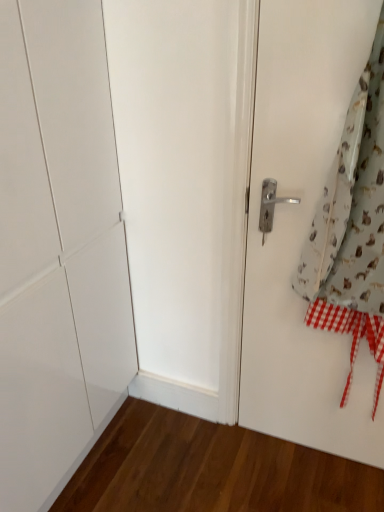
The image size is (384, 512). I want to click on white glossy door at right, so 303,230.

In the scene shown: Measure the distance between point (303, 346) and camera.

Point (303, 346) is 1.46 meters away from camera.

What is the approximate height of white glossy door at right?

1.50 meters.

This screenshot has width=384, height=512. What do you see at coordinates (303, 230) in the screenshot?
I see `white glossy door at right` at bounding box center [303, 230].

Identify the location of white glossy door at right. (303, 230).